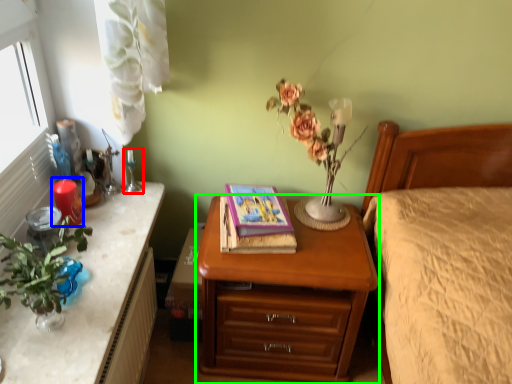
Question: Estimate the real-world distances between objects in this image. Which object is farther from candle holder (highlighted by a red box), candle (highlighted by a blue box) or nightstand (highlighted by a green box)?

Choices:
 (A) candle
 (B) nightstand

Answer: (B)